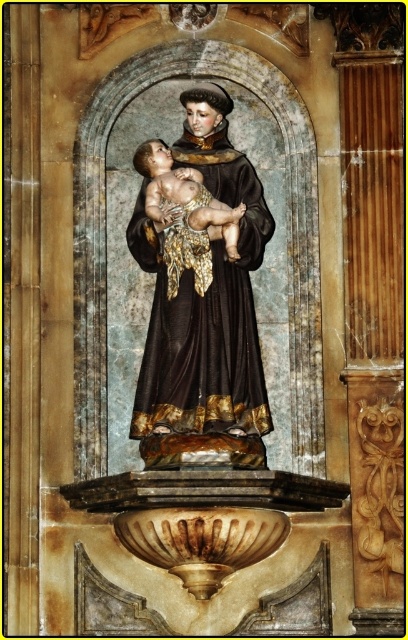
Looking at this image, does shiny dark brown fabric at center have a smaller size compared to smooth gold cloth at center?

No.

Is point (259, 426) in front of point (164, 202)?

Yes, point (259, 426) is closer to viewer.

Between point (152, 264) and point (139, 163), which one is positioned behind?

The point (152, 264) is behind.

Where is `shiny dark brown fabric at center`? shiny dark brown fabric at center is located at coordinates (204, 324).